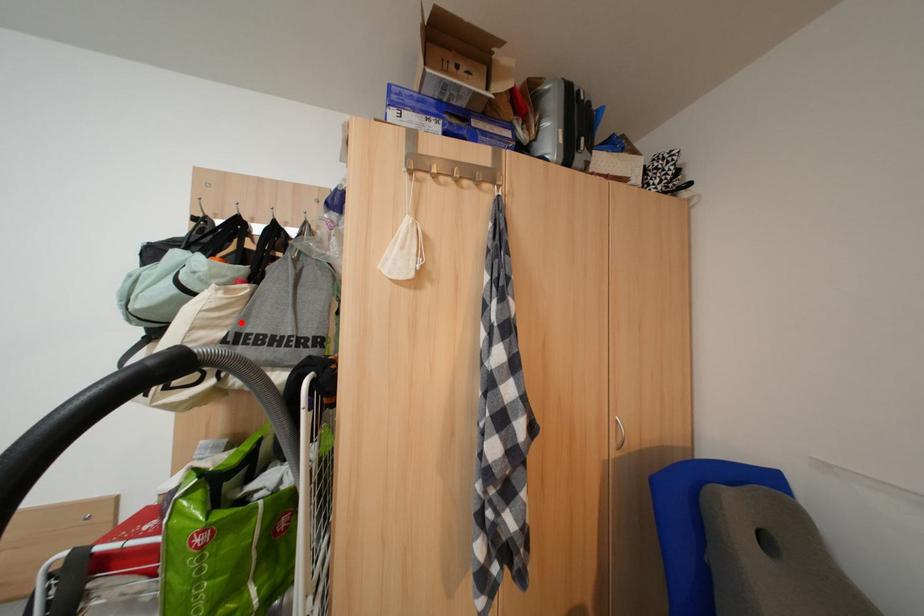
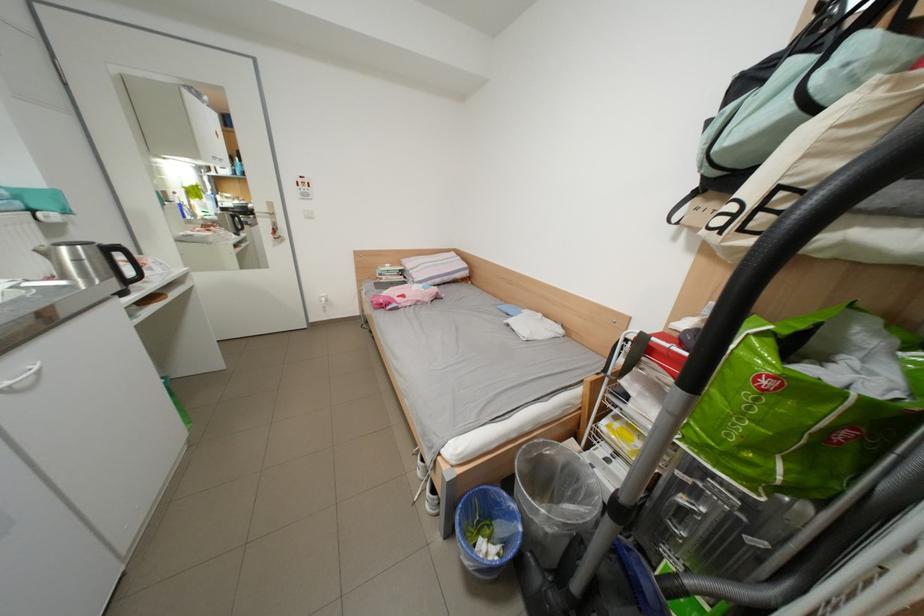
In the second image, find the point that corresponds to the highlighted location in the first image.

(877, 146)